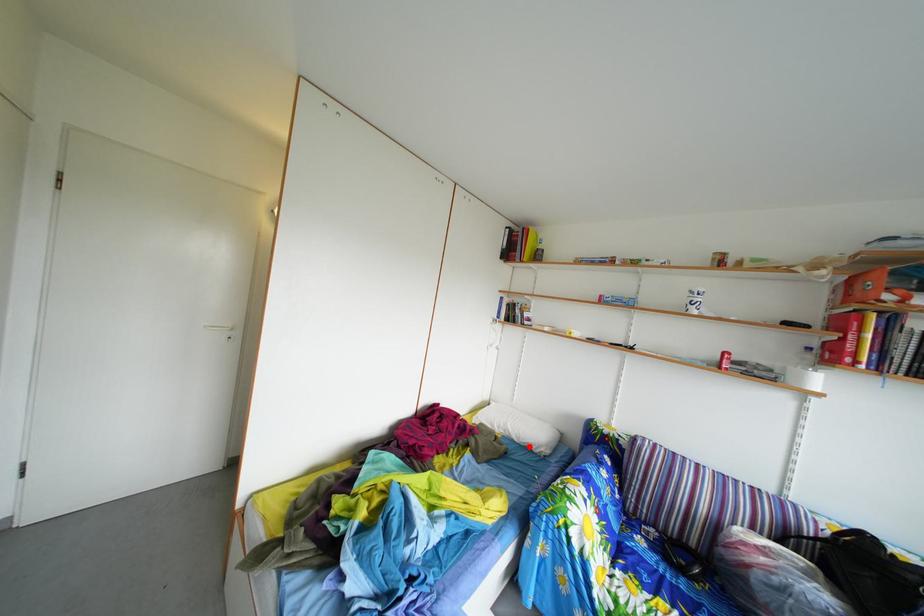
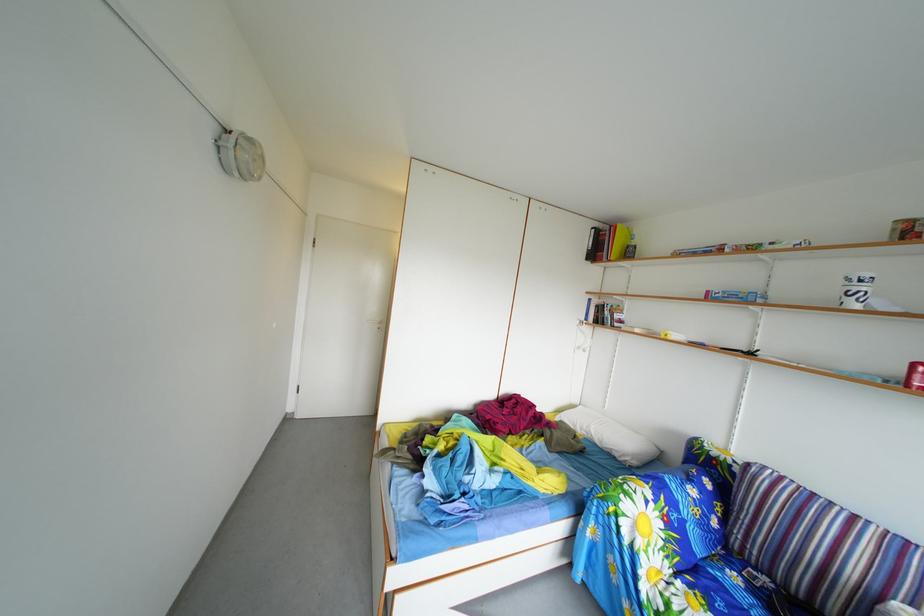
Question: I am providing you with two images of the same scene from different viewpoints. A red point is shown in image1. For the corresponding object point in image2, is it positioned nearer or farther from the camera?

Choices:
 (A) Nearer
 (B) Farther

Answer: (B)